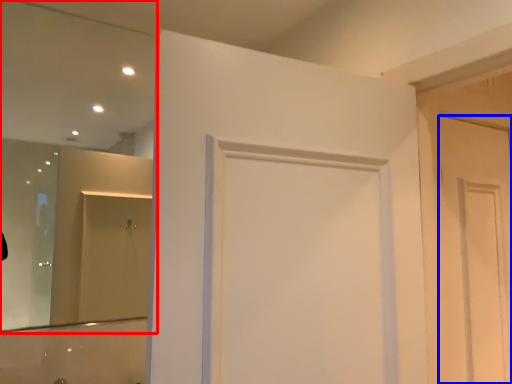
Question: Which point is closer to the camera, mirror (highlighted by a red box) or door (highlighted by a blue box)?

Choices:
 (A) mirror
 (B) door

Answer: (A)